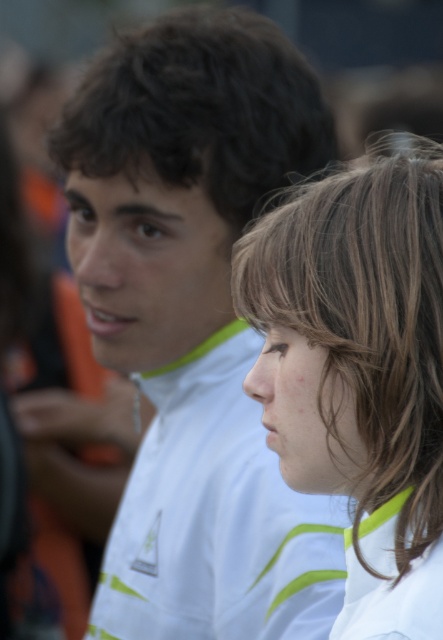
Question: Which object is the closest to the dark brown curly hair at upper center?

Choices:
 (A) brown smooth hair at center
 (B) white matte jacket at center
 (C) white matte shirt at center

Answer: (B)

Question: Can you confirm if white matte shirt at center is positioned below dark brown curly hair at upper center?

Choices:
 (A) no
 (B) yes

Answer: (B)

Question: Does brown smooth hair at center have a larger size compared to white matte shirt at center?

Choices:
 (A) no
 (B) yes

Answer: (A)

Question: Which of the following is the closest to the observer?

Choices:
 (A) brown smooth hair at center
 (B) white matte shirt at center

Answer: (A)

Question: Which point is farther from the camera taking this photo?

Choices:
 (A) (81, 129)
 (B) (132, 288)
 (C) (226, 435)
 (D) (241, 257)

Answer: (B)

Question: Does brown smooth hair at center appear over white matte shirt at center?

Choices:
 (A) yes
 (B) no

Answer: (A)